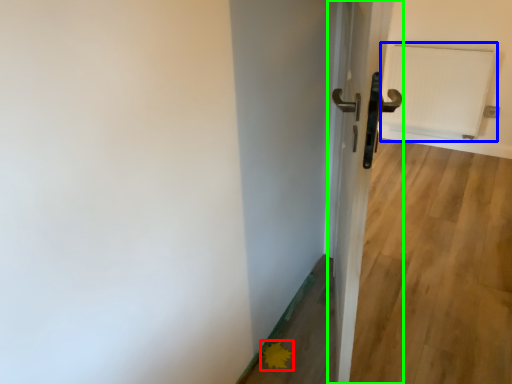
Question: Which is nearer to the flower (highlighted by a red box)? radiator (highlighted by a blue box) or door (highlighted by a green box).

Choices:
 (A) radiator
 (B) door

Answer: (B)